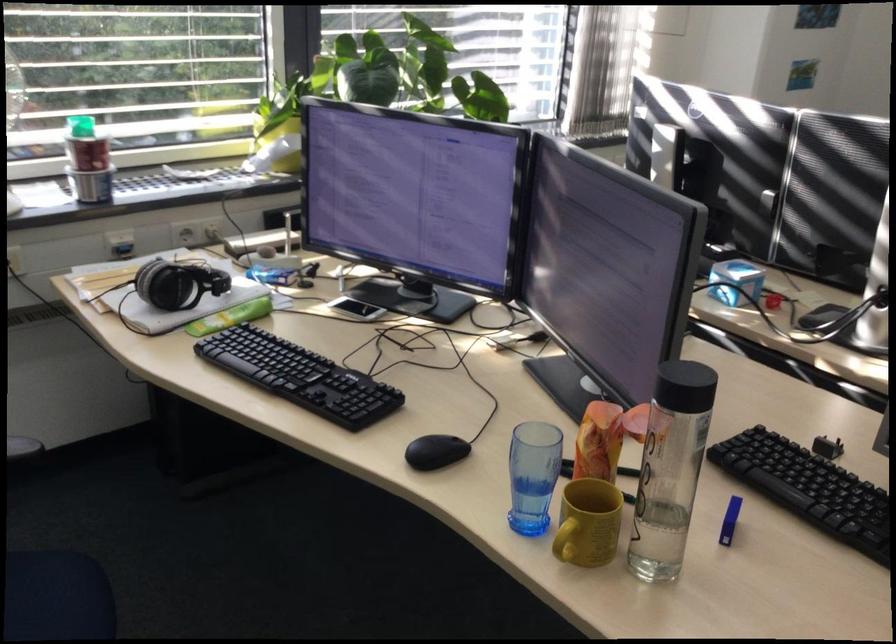
Where would you lift the red and white container? Please return your answer as a coordinate pair (x, y).

(88, 154)